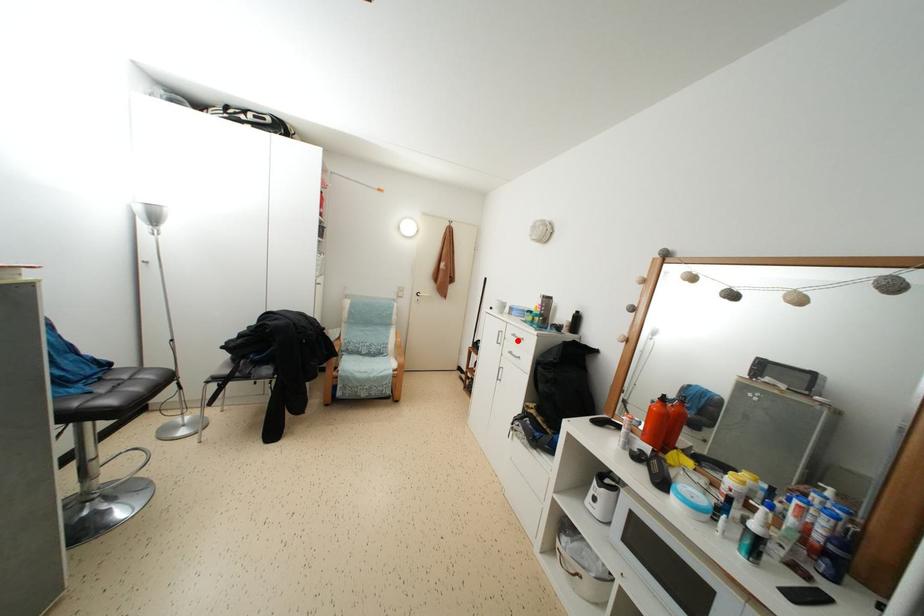
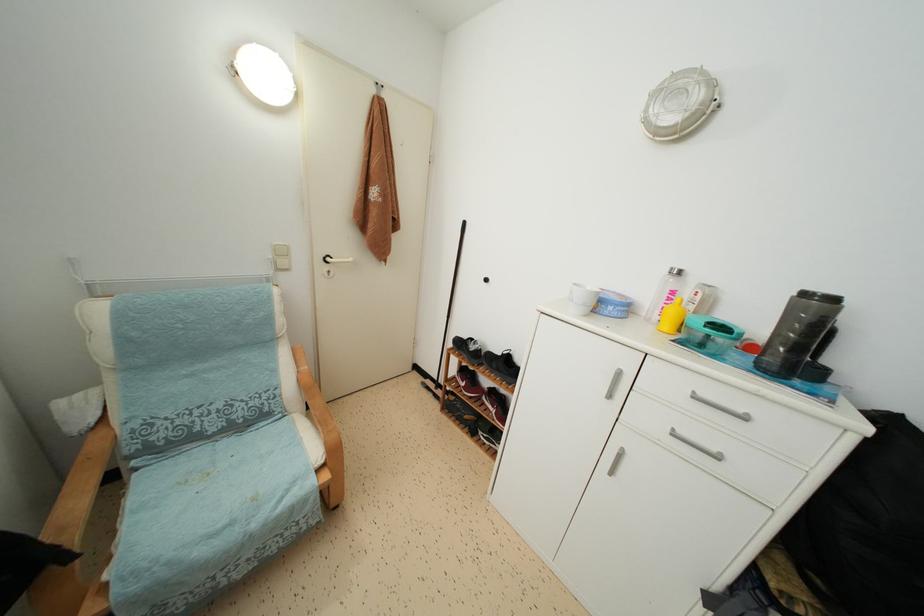
Question: I am providing you with two images of the same scene from different viewpoints. A red point is marked on the first image. At the location where the point appears in image 1, is it still visible in image 2?

Choices:
 (A) Yes
 (B) No

Answer: (A)